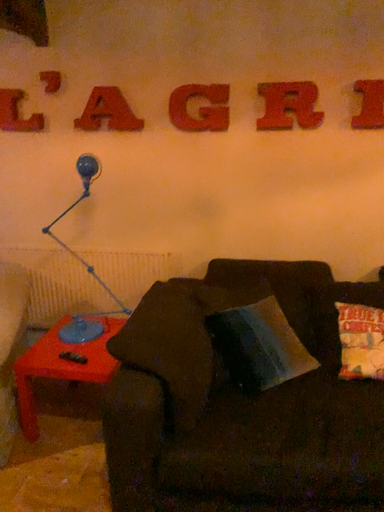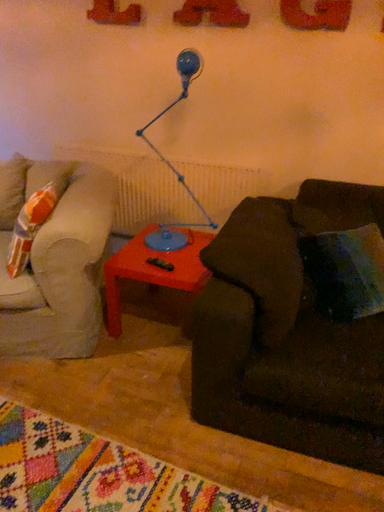
Question: How did the camera likely rotate when shooting the video?

Choices:
 (A) rotated downward
 (B) rotated upward

Answer: (A)